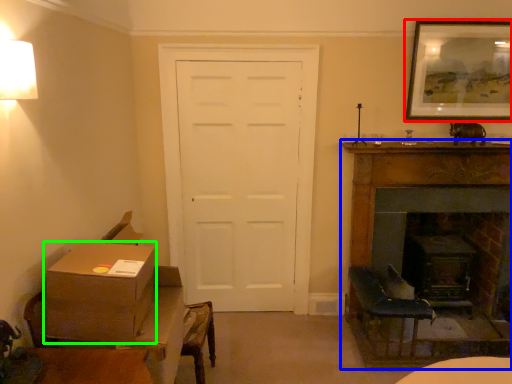
Question: Which object is the closest to the picture frame (highlighted by a red box)? Choose among these: fireplace (highlighted by a blue box) or box (highlighted by a green box).

Choices:
 (A) fireplace
 (B) box

Answer: (A)